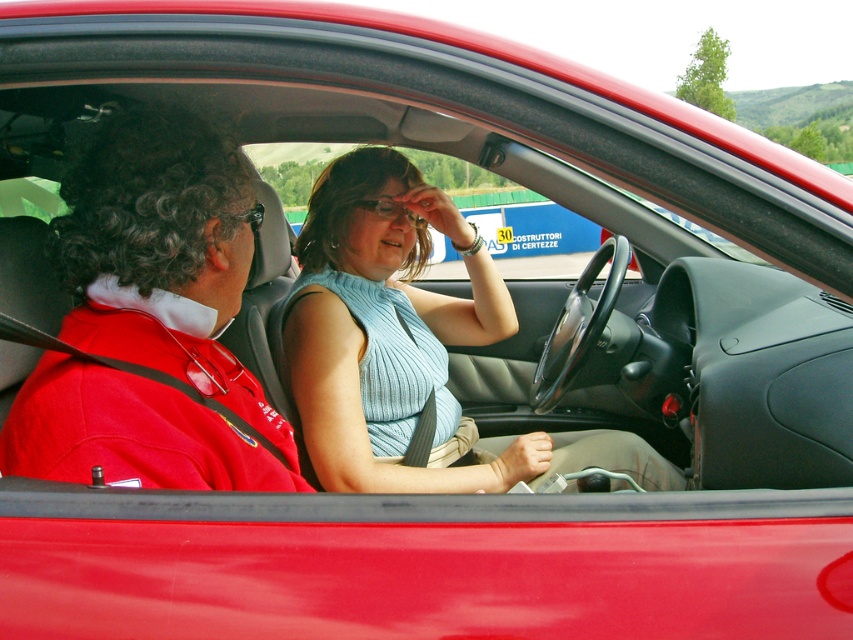
Question: Is red fabric jacket at left smaller than light blue ribbed tank top at center?

Choices:
 (A) yes
 (B) no

Answer: (A)

Question: Which object is farther from the camera taking this photo?

Choices:
 (A) light blue ribbed tank top at center
 (B) red fabric jacket at left

Answer: (A)

Question: Does red fabric jacket at left come behind light blue ribbed tank top at center?

Choices:
 (A) yes
 (B) no

Answer: (B)

Question: Does red fabric jacket at left have a larger size compared to light blue ribbed tank top at center?

Choices:
 (A) yes
 (B) no

Answer: (B)